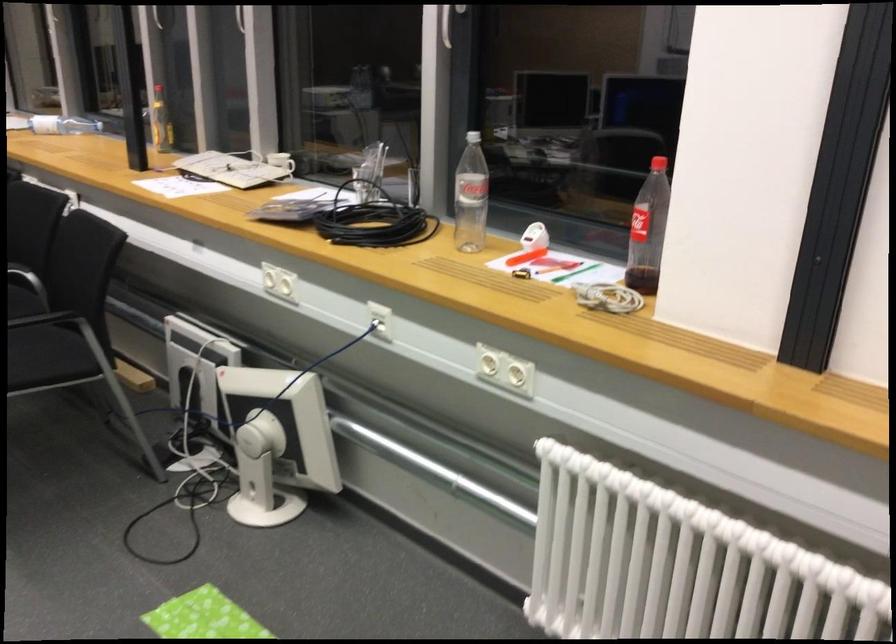
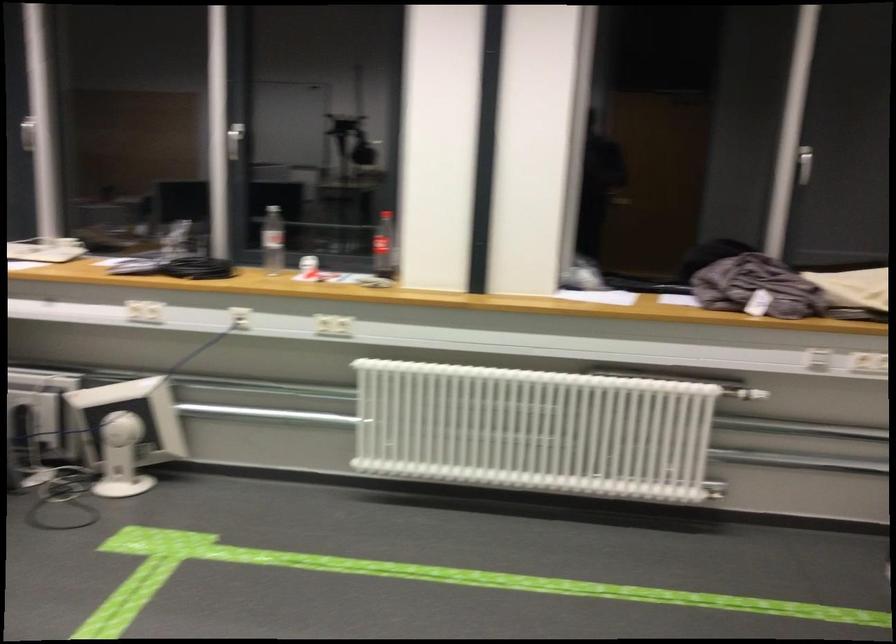
Find the pixel in the second image that matches (x=639, y=212) in the first image.

(383, 245)